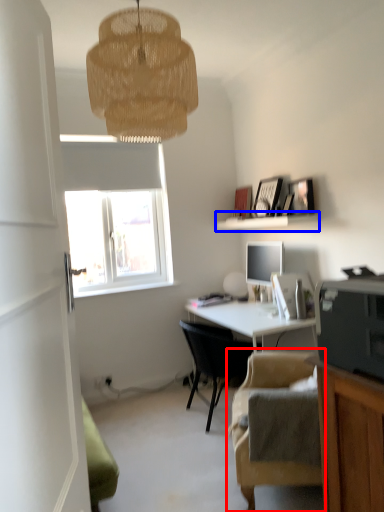
Question: Which object appears closest to the camera in this image, chair (highlighted by a red box) or shelf (highlighted by a blue box)?

Choices:
 (A) chair
 (B) shelf

Answer: (A)